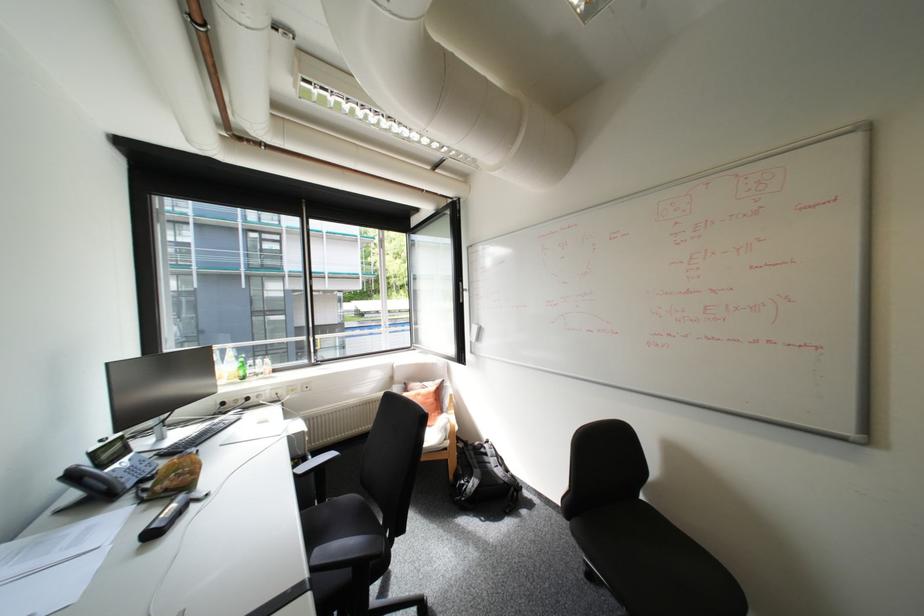
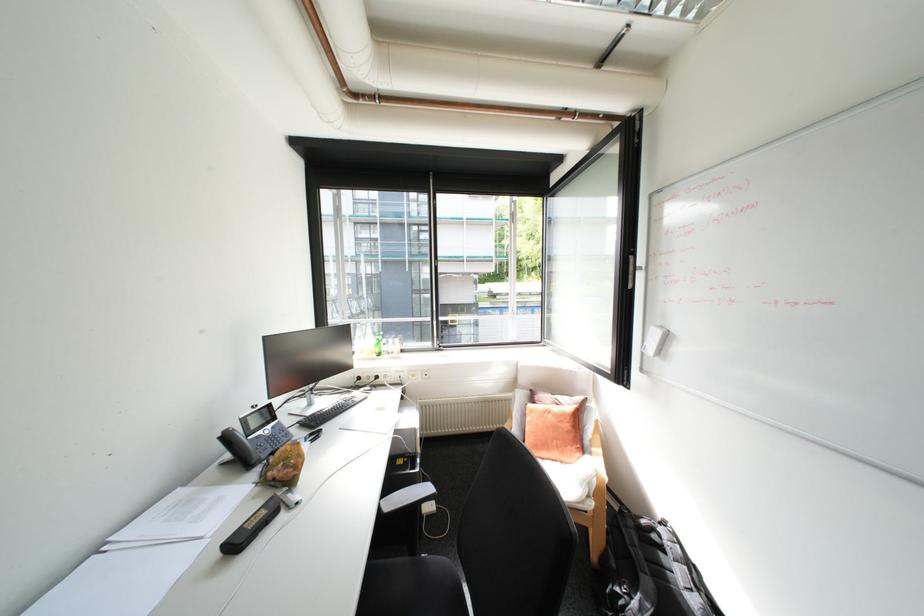
Question: The images are taken continuously from a first-person perspective. In which direction is your viewpoint rotating?

Choices:
 (A) Left
 (B) Right
 (C) Up
 (D) Down

Answer: (A)